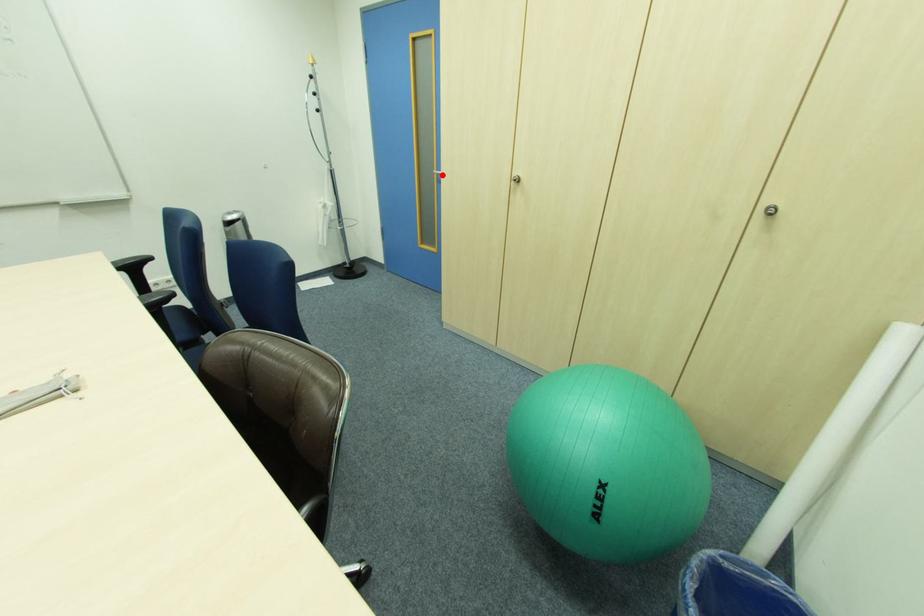
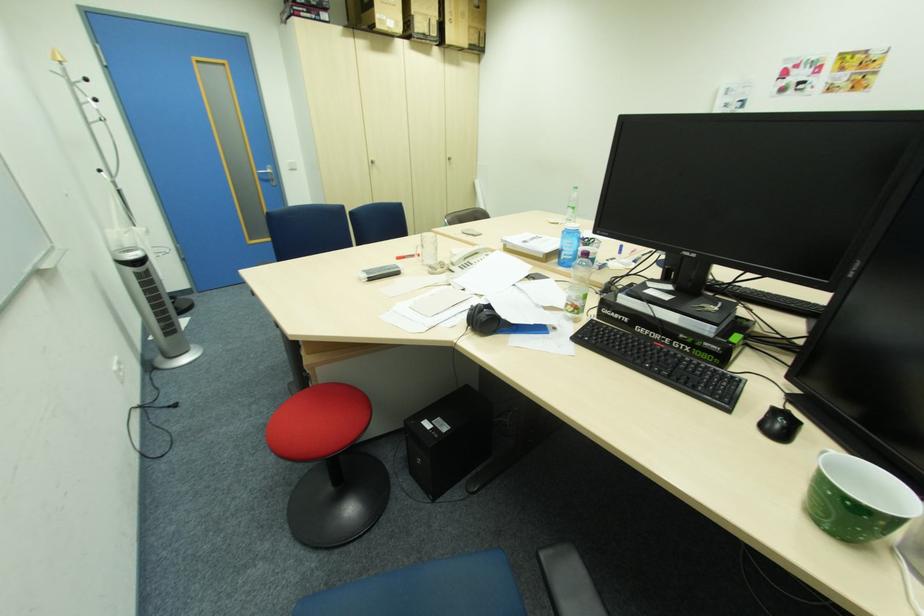
Locate, in the second image, the point that corresponds to the highlighted location in the first image.

(264, 174)